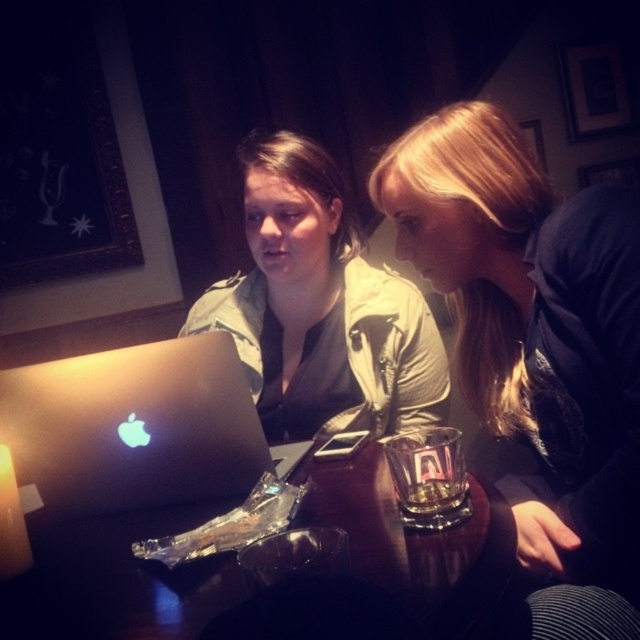
Question: Does blonde hair at upper right have a larger size compared to black matte laptop at center?

Choices:
 (A) yes
 (B) no

Answer: (A)

Question: Can you confirm if wooden table at center is positioned to the right of black matte laptop at center?

Choices:
 (A) yes
 (B) no

Answer: (A)

Question: Does wooden table at center appear on the left side of black matte laptop at center?

Choices:
 (A) yes
 (B) no

Answer: (B)

Question: Among these objects, which one is nearest to the camera?

Choices:
 (A) matte khaki jacket at center
 (B) black matte laptop at center

Answer: (B)

Question: Among these objects, which one is farthest from the camera?

Choices:
 (A) wooden table at center
 (B) matte khaki jacket at center

Answer: (B)

Question: Which point is farther from the camera taking this photo?

Choices:
 (A) (426, 554)
 (B) (211, 435)
 (C) (349, 300)

Answer: (C)